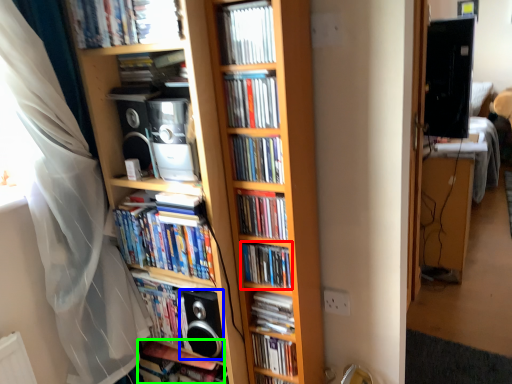
Question: Estimate the real-world distances between objects in this image. Which object is farther from book (highlighted by a red box), speaker (highlighted by a blue box) or book (highlighted by a green box)?

Choices:
 (A) speaker
 (B) book

Answer: (B)